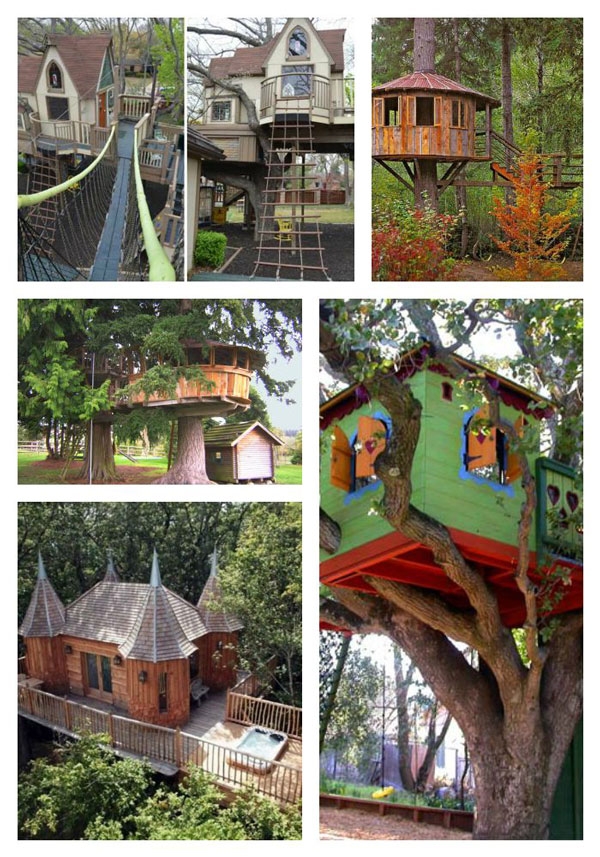
You are a GUI agent. You are given a task and a screenshot of the screen. Output one action in this format:
    pyautogui.click(x=<x>, y=<y>)
    Task: Click on the ladder
    The image size is (600, 857).
    Given the screenshot: What is the action you would take?
    pyautogui.click(x=293, y=210), pyautogui.click(x=292, y=806), pyautogui.click(x=176, y=446), pyautogui.click(x=45, y=187), pyautogui.click(x=465, y=218), pyautogui.click(x=332, y=696)